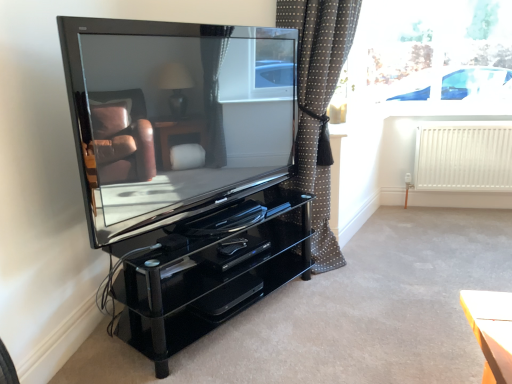
Where is `vacant space to the right of polka dot fabric curtain at center`? Image resolution: width=512 pixels, height=384 pixels. vacant space to the right of polka dot fabric curtain at center is located at coordinates (407, 250).